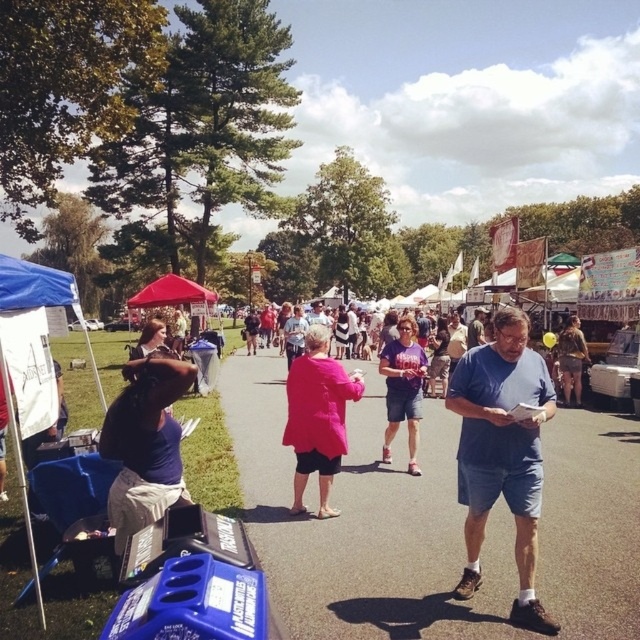
Question: Which of these objects is positioned closest to the blue fabric at center?

Choices:
 (A) camouflage-patterned shorts at right
 (B) purple cotton shirt at center

Answer: (B)

Question: Which point is farther to the camera?

Choices:
 (A) blue fabric at center
 (B) pink fabric at center
 (C) camouflage-patterned shorts at right
 (D) dark blue shirt at lower left

Answer: (C)

Question: Can you confirm if blue cotton shirt at center is positioned to the right of pink fabric at center?

Choices:
 (A) no
 (B) yes

Answer: (A)

Question: Does blue fabric at center have a smaller size compared to purple cotton shirt at center?

Choices:
 (A) no
 (B) yes

Answer: (A)

Question: Which point is farther to the camera?

Choices:
 (A) (451, 349)
 (B) (420, 358)
 (C) (586, 342)
 (D) (387, 612)

Answer: (A)

Question: Is pink matte jacket at center wider than camouflage-patterned shorts at right?

Choices:
 (A) no
 (B) yes

Answer: (B)